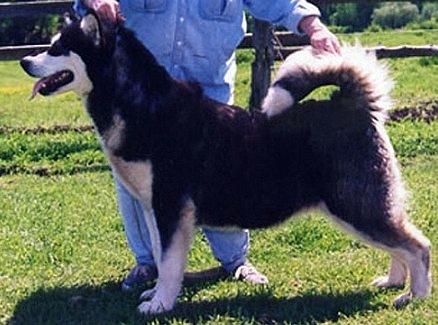
At what (x,y) coordinates should I click in order to perform the action: click on table. Please return your answer as a coordinate pair (x, y). The height and width of the screenshot is (325, 438). Looking at the image, I should click on click(297, 72).